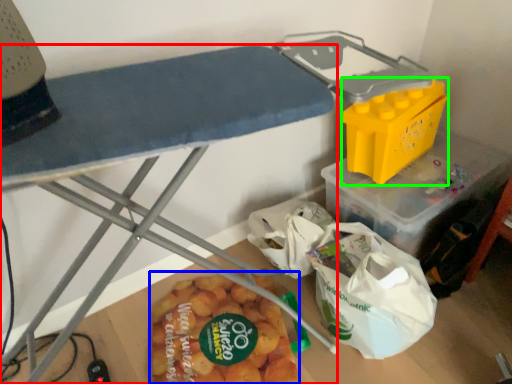
Question: Based on their relative distances, which object is nearer to furniture (highlighted by a red box)? Choose from food (highlighted by a blue box) and box (highlighted by a green box).

Choices:
 (A) food
 (B) box

Answer: (A)